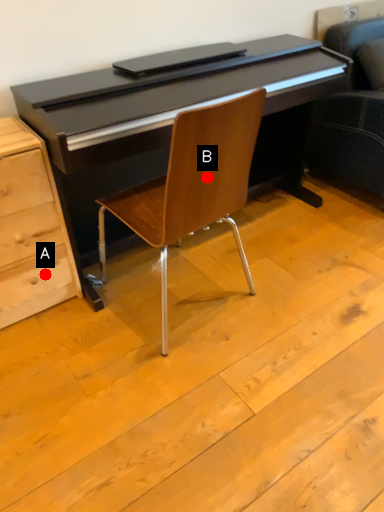
Question: Two points are circled on the image, labeled by A and B beside each circle. Which of the following is the farthest from the observer?

Choices:
 (A) A is further
 (B) B is further

Answer: (A)